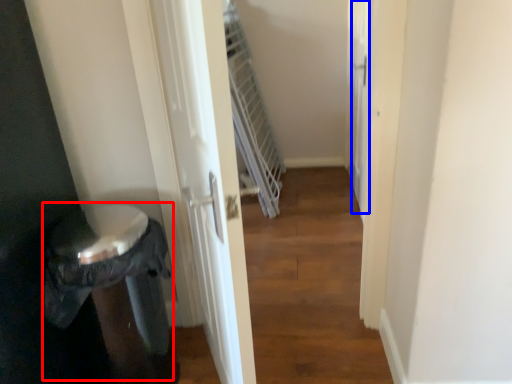
Question: Which of the following is the closest to the observer, potty (highlighted by a red box) or screen door (highlighted by a blue box)?

Choices:
 (A) potty
 (B) screen door

Answer: (A)